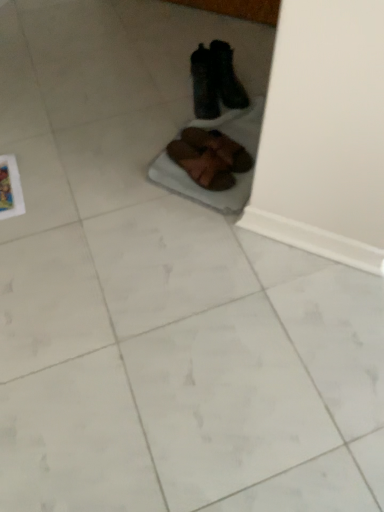
At what (x,y) coordinates should I click in order to perform the action: click on vacant space in front of brown suede shoes at center, which ranks as the third footwear in top-to-bottom order. Please return your answer as a coordinate pair (x, y). The height and width of the screenshot is (512, 384). Looking at the image, I should click on (213, 193).